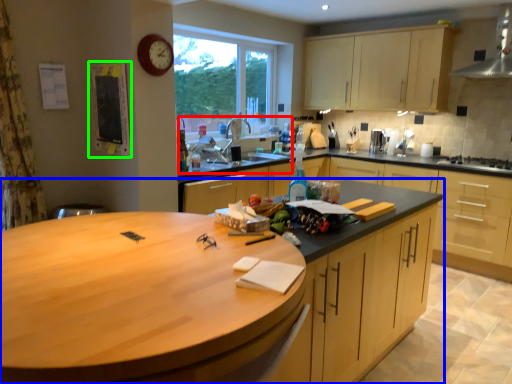
Question: Estimate the real-world distances between objects in this image. Which object is farther from sink (highlighted by a red box), countertop (highlighted by a blue box) or bulletin board (highlighted by a green box)?

Choices:
 (A) countertop
 (B) bulletin board

Answer: (A)